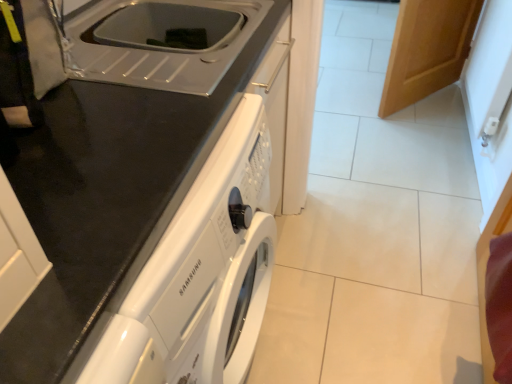
The width and height of the screenshot is (512, 384). Identify the location of vacant space in front of wooden door at upper right. (421, 130).